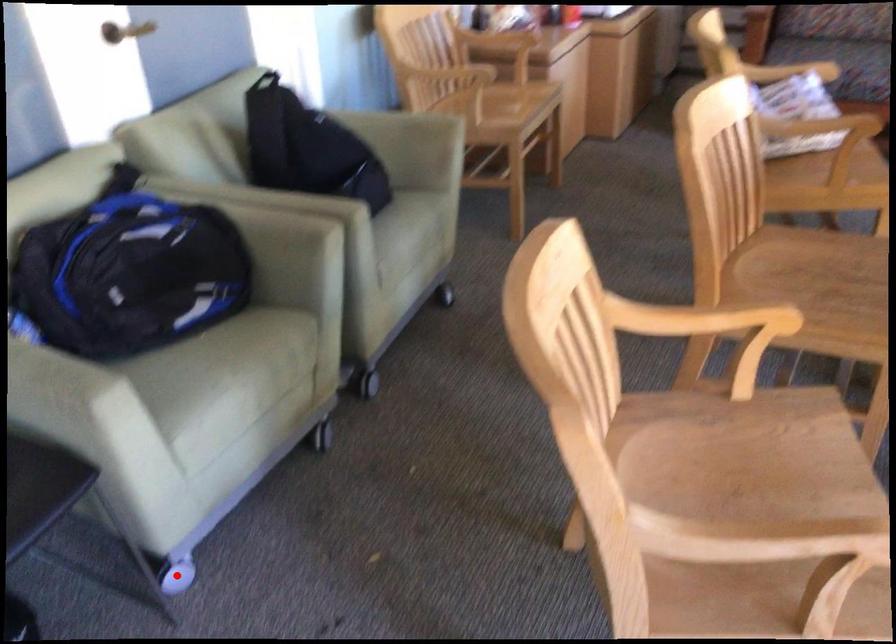
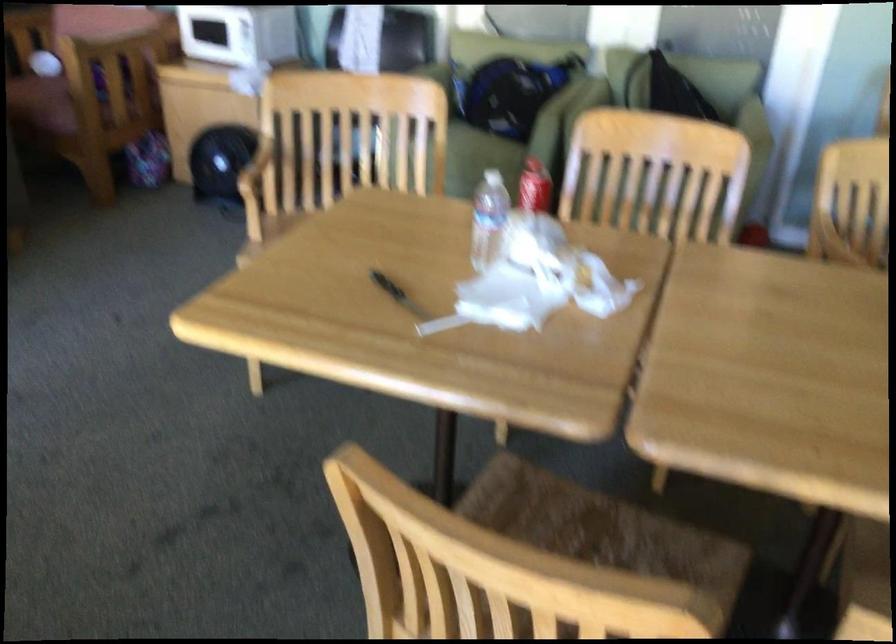
Question: I am providing you with two images of the same scene from different viewpoints. A red point is marked on the first image. At the location where the point appears in image 1, is it still visible in image 2?

Choices:
 (A) Yes
 (B) No

Answer: (B)